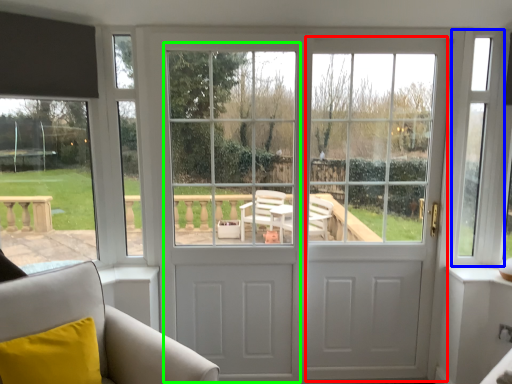
Question: Based on their relative distances, which object is nearer to screen door (highlighted by a red box)? Choose from window screen (highlighted by a blue box) and screen door (highlighted by a green box).

Choices:
 (A) window screen
 (B) screen door

Answer: (A)